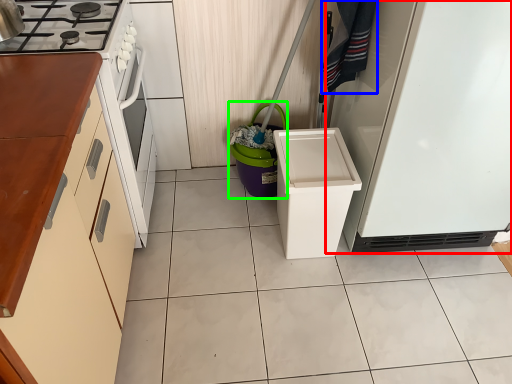
Question: Estimate the real-world distances between objects in this image. Which object is closer to refrigerator (highlighted by a red box), laundry (highlighted by a blue box) or appliance (highlighted by a green box)?

Choices:
 (A) laundry
 (B) appliance

Answer: (A)